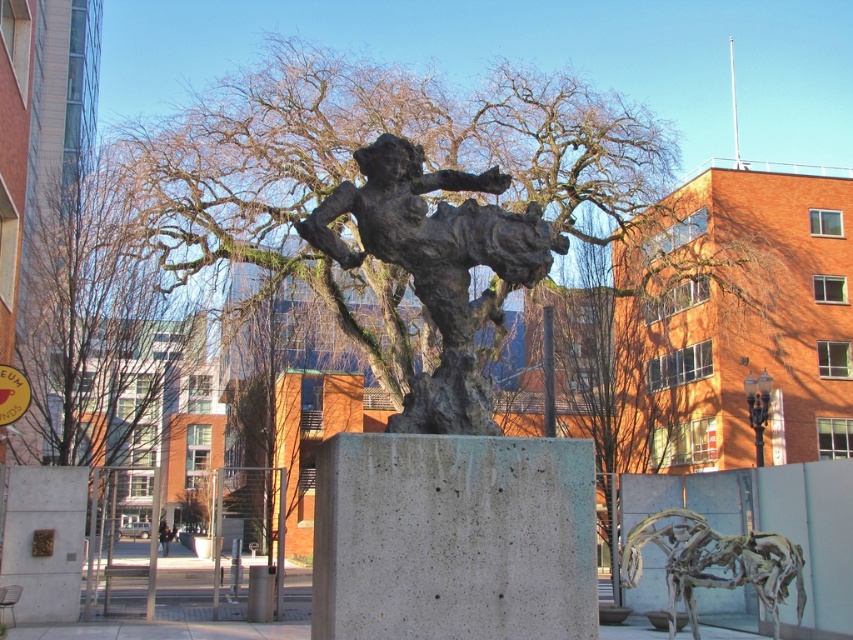
Question: Can you confirm if rustic bronze horse at lower right is thinner than dark clothing at lower center?

Choices:
 (A) no
 (B) yes

Answer: (B)

Question: Is bronze textured figure at center smaller than dark clothing at lower center?

Choices:
 (A) yes
 (B) no

Answer: (A)

Question: Which point is closer to the camera taking this photo?

Choices:
 (A) (54, 240)
 (B) (486, 234)
 (C) (161, 531)
 (D) (643, 525)

Answer: (B)

Question: Can you confirm if bronze textured figure at center is bigger than rustic bronze horse at lower right?

Choices:
 (A) yes
 (B) no

Answer: (B)

Question: Estimate the real-world distances between objects in this image. Which object is farther from the bare branches at center?

Choices:
 (A) bronze textured figure at center
 (B) dark clothing at lower center
 (C) rustic bronze horse at lower right

Answer: (A)

Question: Among these objects, which one is nearest to the camera?

Choices:
 (A) bronze textured figure at center
 (B) dark clothing at lower center
 (C) rustic bronze horse at lower right
 (D) bare branches at center

Answer: (A)